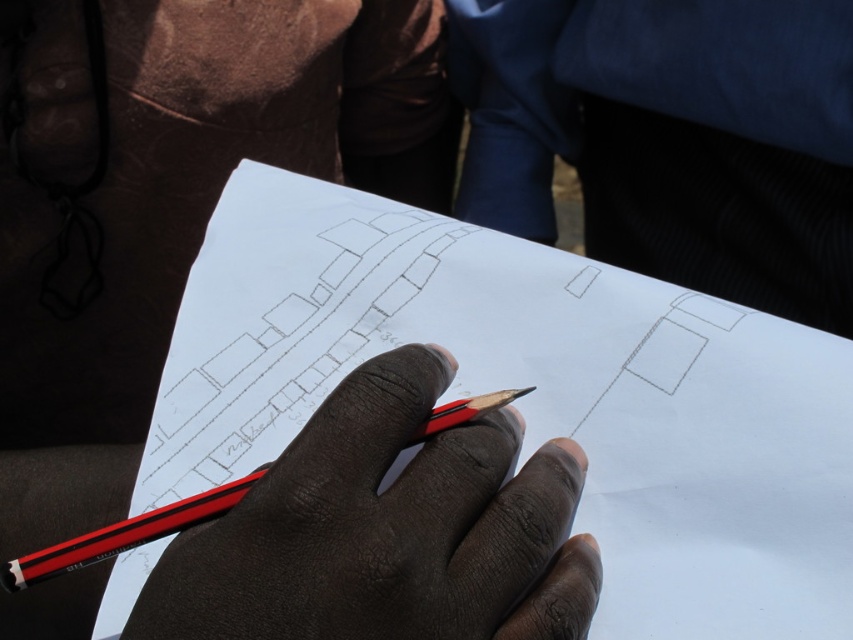
Question: Which point is closer to the camera?

Choices:
 (A) (253, 589)
 (B) (692, 477)

Answer: (A)

Question: Does white paper at center lie behind black matte pencil at center?

Choices:
 (A) no
 (B) yes

Answer: (B)

Question: Which of the following is the farthest from the observer?

Choices:
 (A) (437, 451)
 (B) (607, 496)

Answer: (B)

Question: Is white paper at center to the right of black matte pencil at center from the viewer's perspective?

Choices:
 (A) no
 (B) yes

Answer: (B)

Question: Is white paper at center wider than black matte pencil at center?

Choices:
 (A) yes
 (B) no

Answer: (A)

Question: Among these points, which one is nearest to the camera?

Choices:
 (A) (368, 371)
 (B) (682, 333)

Answer: (A)